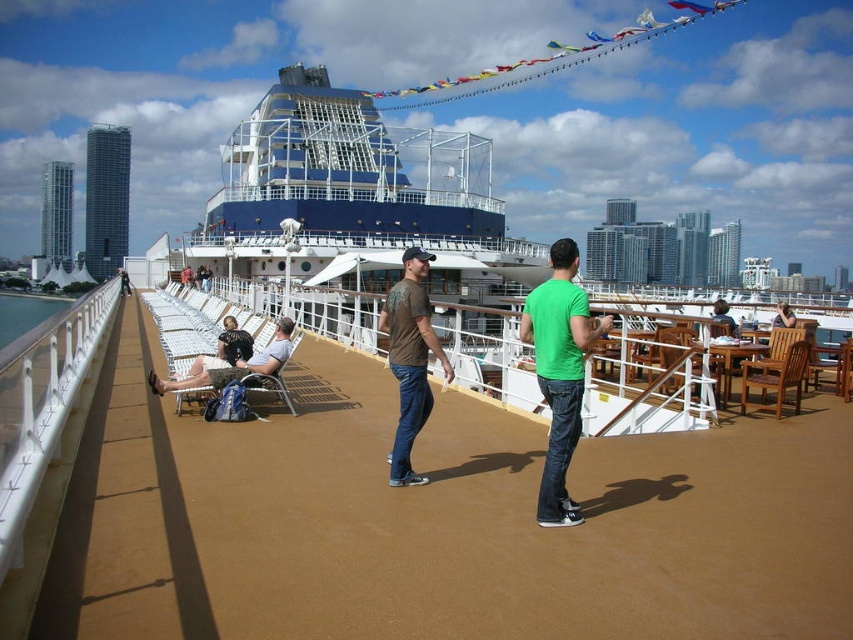
Question: Which is farther from the dark brown leather chairs at center?

Choices:
 (A) green matte t-shirt at center
 (B) brown cotton t-shirt at center

Answer: (A)

Question: Can you confirm if brown smooth deck at center is thinner than dark brown leather chairs at center?

Choices:
 (A) no
 (B) yes

Answer: (A)

Question: From the image, what is the correct spatial relationship of brown smooth deck at center in relation to matte black shorts at center?

Choices:
 (A) below
 (B) above

Answer: (A)

Question: Is brown smooth deck at center wider than dark brown leather chairs at center?

Choices:
 (A) yes
 (B) no

Answer: (A)

Question: Which point is farther to the camera?

Choices:
 (A) brown smooth deck at center
 (B) green matte t-shirt at center
 (C) matte black shorts at center

Answer: (C)

Question: Which object is closer to the camera taking this photo?

Choices:
 (A) brown cotton t-shirt at center
 (B) green matte t-shirt at center

Answer: (B)